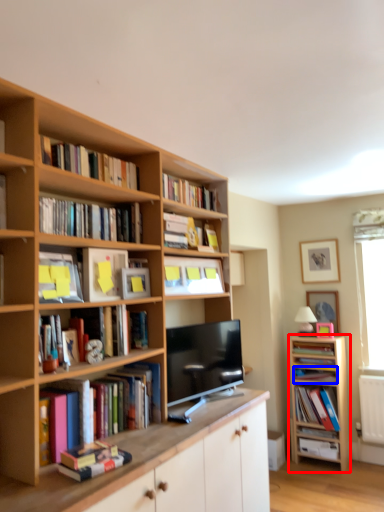
Question: Which point is closer to the camera, cabinetry (highlighted by a red box) or book (highlighted by a blue box)?

Choices:
 (A) cabinetry
 (B) book

Answer: (A)